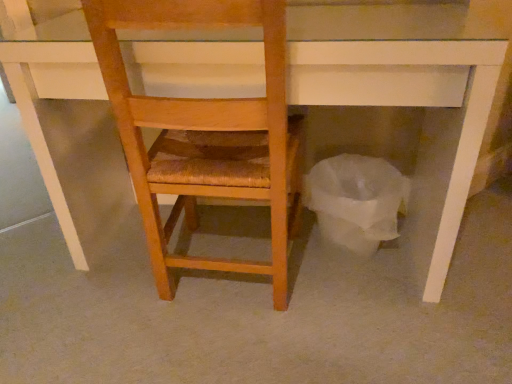
Where is `free point to the left of white paper bag at lower right`? The width and height of the screenshot is (512, 384). free point to the left of white paper bag at lower right is located at coordinates (266, 251).